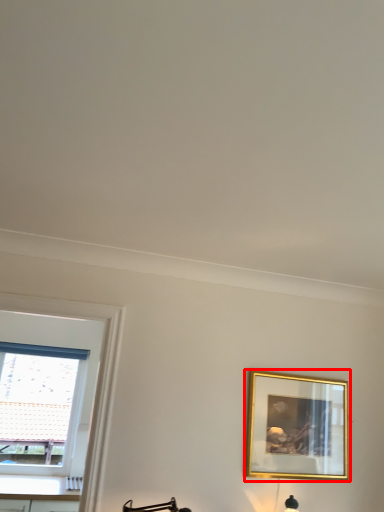
Question: Observing the image, what is the correct spatial positioning of picture frame (annotated by the red box) in reference to window?

Choices:
 (A) right
 (B) left

Answer: (A)